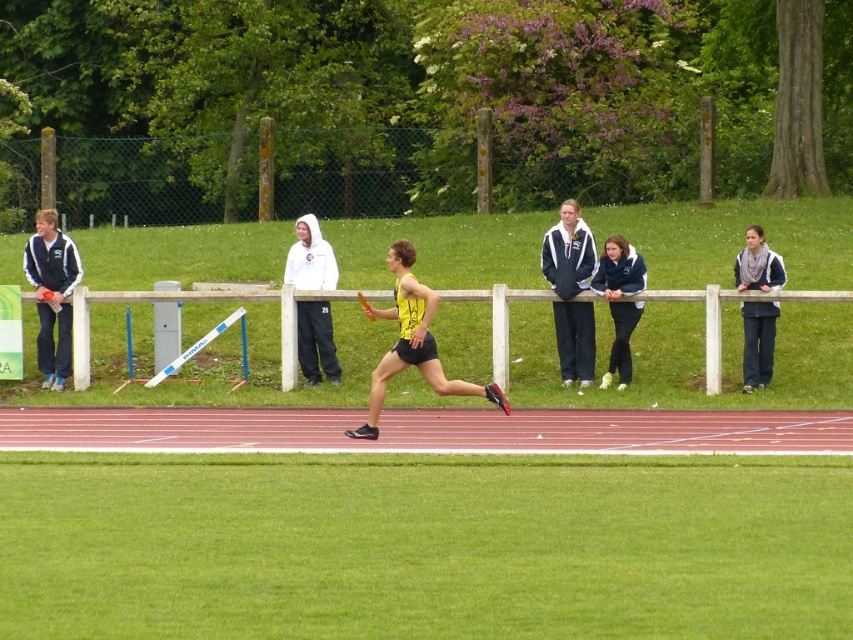
Can you confirm if green fleece jacket at left is thinner than dark blue sweater at right?

In fact, green fleece jacket at left might be wider than dark blue sweater at right.

Is point (65, 282) farther from viewer compared to point (758, 385)?

Yes, it is.

Is point (62, 385) positioned behind point (756, 250)?

Yes, it is behind point (756, 250).

Identify the location of green fleece jacket at left. (51, 294).

Can you confirm if green fleece jacket at left is positioned above dark blue jacket at center?

Yes.

Can you confirm if green fleece jacket at left is wider than dark blue jacket at center?

Answer: Correct, the width of green fleece jacket at left exceeds that of dark blue jacket at center.

Consider the image. Who is more distant from viewer, (74, 272) or (624, 284)?

Positioned behind is point (74, 272).

Where is `green fleece jacket at left`? green fleece jacket at left is located at coordinates (51, 294).

In the scene shown: Which of these two, yellow/black athletic uniform at center or dark blue jacket at center, stands taller?

Standing taller between the two is yellow/black athletic uniform at center.

Is yellow/black athletic uniform at center bigger than dark blue jacket at center?

Yes.

Between point (399, 324) and point (624, 284), which one is positioned in front?

Point (399, 324) is in front.

I want to click on yellow/black athletic uniform at center, so click(x=413, y=342).